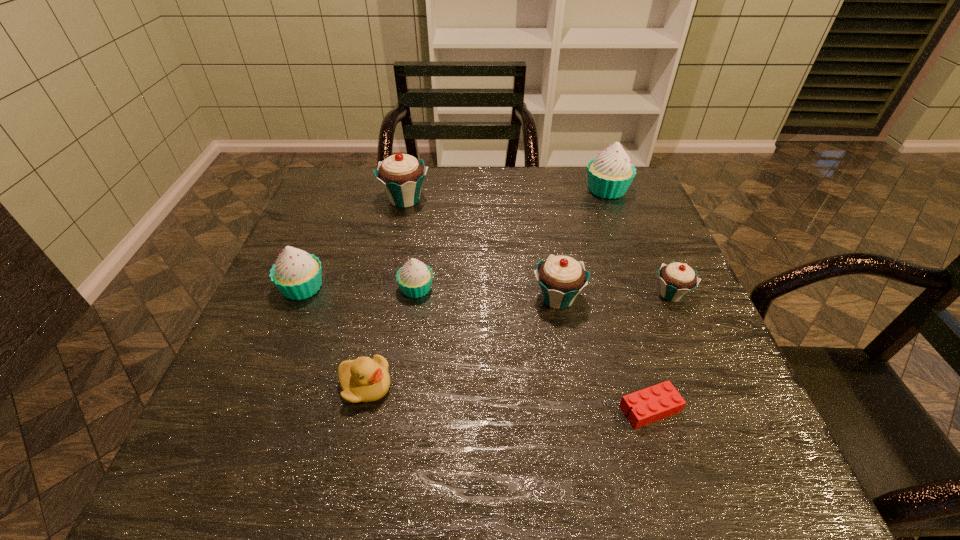
Where is `the rightmost white cupcake`? the rightmost white cupcake is located at coordinates (610, 174).

Locate an element on the screen. the biggest white cupcake is located at coordinates (610, 174).

Where is `the biggest teal cupcake`? The height and width of the screenshot is (540, 960). the biggest teal cupcake is located at coordinates (401, 175).

You are a GUI agent. You are given a task and a screenshot of the screen. Output one action in this format:
    pyautogui.click(x=<x>, y=<y>)
    Task: Click on the leftmost teal cupcake
    This screenshot has height=540, width=960.
    Given the screenshot: What is the action you would take?
    pyautogui.click(x=401, y=175)

Find the location of a particular element. Image resolution: width=960 pixels, height=540 pixels. the second biggest white cupcake is located at coordinates (297, 274).

Find the location of `the leftmost object`. the leftmost object is located at coordinates (297, 274).

Image resolution: width=960 pixels, height=540 pixels. What are the coordinates of `the fifth object from left to right` in the screenshot? It's located at (561, 278).

Find the location of a particular element. The image size is (960, 540). the second teal cupcake from left to right is located at coordinates (x=561, y=278).

Identify the location of the smallest white cupcake. (415, 278).

The height and width of the screenshot is (540, 960). In order to click on the rightmost teal cupcake in this screenshot , I will do `click(676, 279)`.